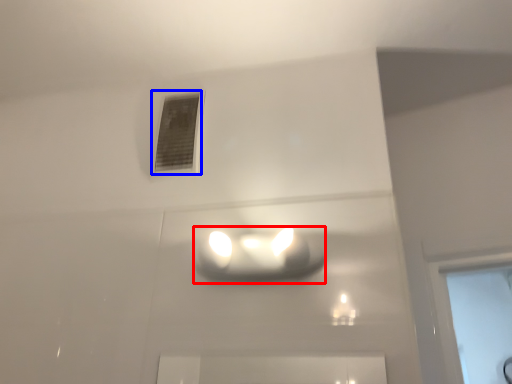
Question: Which of the following is the farthest to the observer, lamp (highlighted by a red box) or window (highlighted by a blue box)?

Choices:
 (A) lamp
 (B) window

Answer: (B)